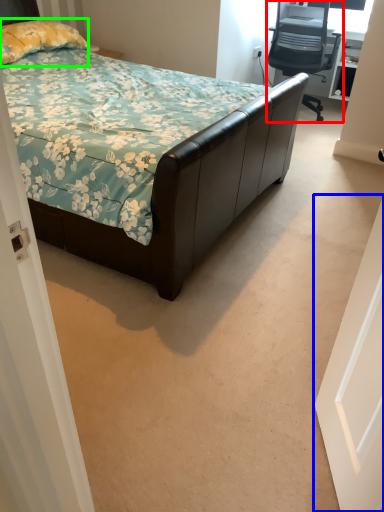
Question: Estimate the real-world distances between objects in this image. Which object is farther from chair (highlighted by a red box), door (highlighted by a blue box) or pillow (highlighted by a green box)?

Choices:
 (A) door
 (B) pillow

Answer: (A)